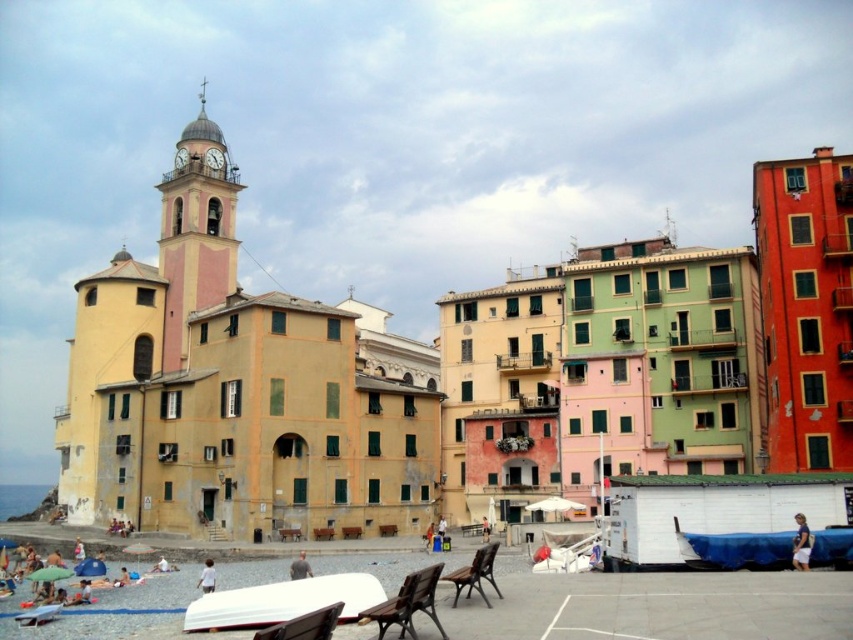
In order to click on blue tarpaulin boat at lower right in this screenshot , I will do `click(737, 548)`.

Does blue tarpaulin boat at lower right have a lesser height compared to beige fabric towel at lower left?

In fact, blue tarpaulin boat at lower right may be taller than beige fabric towel at lower left.

Locate an element on the screen. Image resolution: width=853 pixels, height=640 pixels. blue tarpaulin boat at lower right is located at coordinates (737, 548).

What do you see at coordinates (196, 230) in the screenshot?
I see `pink painted stone bell tower at upper left` at bounding box center [196, 230].

Does point (173, 294) lie in front of point (160, 570)?

No.

Identify the location of pink painted stone bell tower at upper left. (196, 230).

Is blue tarpaulin boat at lower right positioned before white fabric umbrella at lower left?

Yes, blue tarpaulin boat at lower right is closer to the viewer.

Who is more distant from viewer, (786, 532) or (163, 566)?

The point (163, 566) is behind.

Which is behind, point (842, 532) or point (155, 568)?

Positioned behind is point (155, 568).

Locate an element on the screen. This screenshot has width=853, height=640. blue tarpaulin boat at lower right is located at coordinates (737, 548).